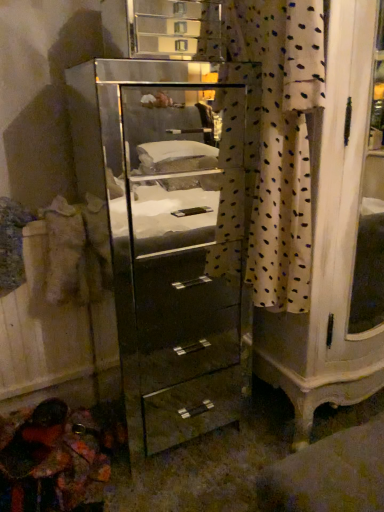
Where is `free region under mirror-finished glass chest of drawers at center (from a real-world perspective)`? free region under mirror-finished glass chest of drawers at center (from a real-world perspective) is located at coordinates (182, 419).